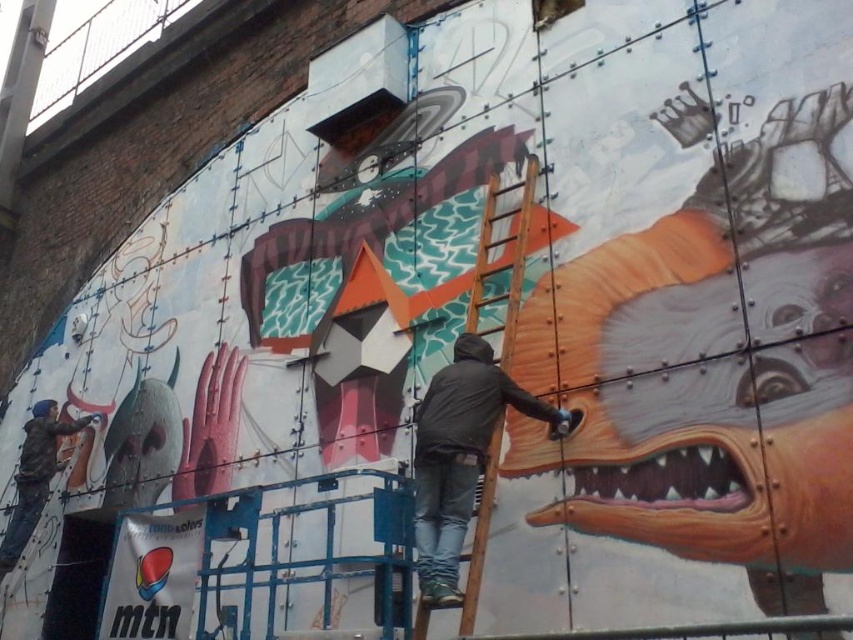
You are a painter standing on a blue scaffolding platform. You see two jackets, the dark gray jacket at center and the matte black jacket at left. Which jacket is higher up?

The dark gray jacket at center is above the matte black jacket at left, so the dark gray jacket at center is higher up.

You are an artist standing on the blue scaffolding platform while painting the mural. You notice two points on the wall marked as point 1 at coordinates (426,620) and point 2 at coordinates (13,548). Which point is closer to your current position?

Point 1 at coordinates (426,620) is closer to the viewer than point 2 at coordinates (13,548).

You are a painter who wants to reach the upper part of the mural. You have a wooden ladder at center and a matte black jacket at left. Which object should you use to climb up?

The wooden ladder at center is positioned on the right side of matte black jacket at left. Since ladders are designed for climbing, you should use the wooden ladder at center to reach the upper part of the mural.